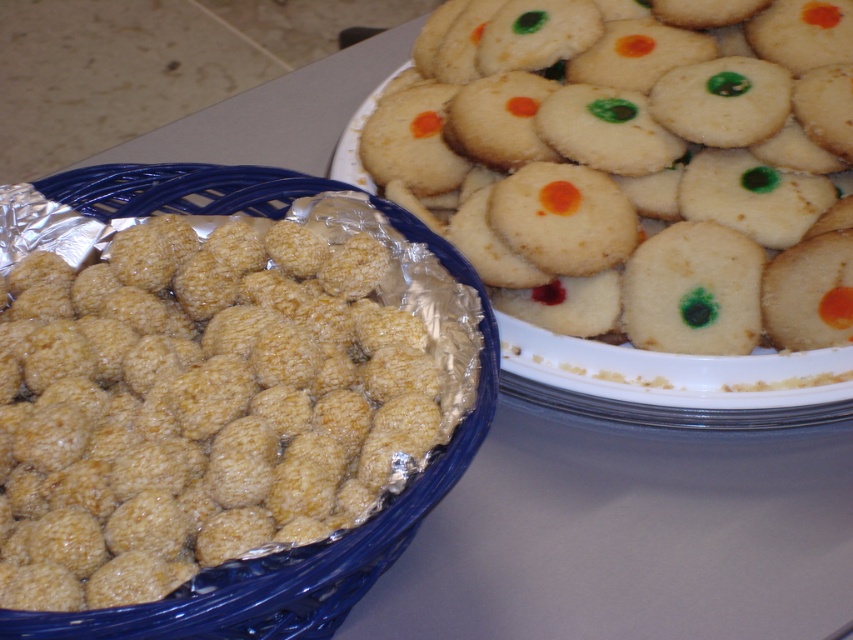
In the scene shown: Between golden textured balls at left and matte white cookie at upper right, which one appears on the left side from the viewer's perspective?

golden textured balls at left

Which is above, golden textured balls at left or matte white cookie at upper right?

matte white cookie at upper right is above.

Identify the location of golden textured balls at left. (196, 404).

I want to click on golden textured balls at left, so click(196, 404).